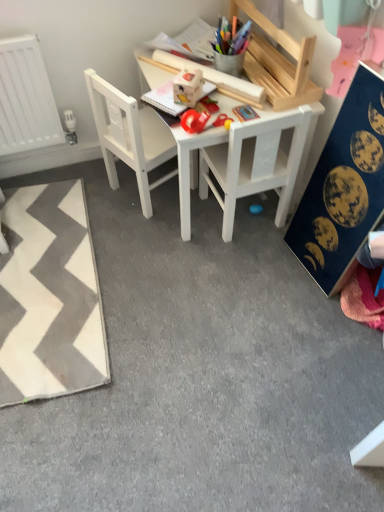
I want to click on empty space that is in between white matte chair at center, which is the first chair in right-to-left order, and white zigzag rug at lower left, so click(152, 267).